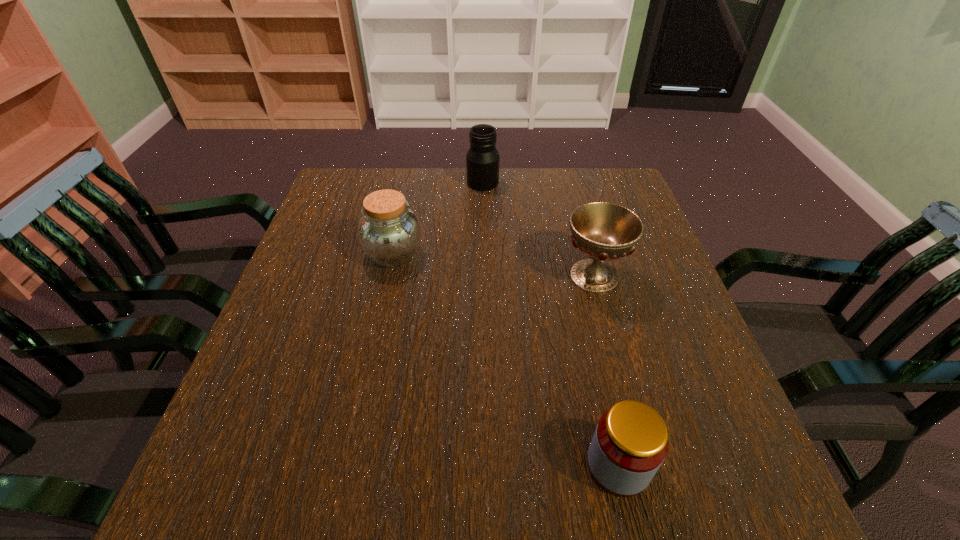
Where is `the farthest object`? Image resolution: width=960 pixels, height=540 pixels. the farthest object is located at coordinates (482, 159).

This screenshot has height=540, width=960. Find the location of `the second jar from right to left`. the second jar from right to left is located at coordinates [482, 159].

Where is `the leftmost jar`? This screenshot has height=540, width=960. the leftmost jar is located at coordinates (389, 232).

The image size is (960, 540). Find the location of `the second nearest jar`. the second nearest jar is located at coordinates (389, 232).

At what (x,y) coordinates should I click in order to perform the action: click on chalice. Please return your answer as a coordinate pair (x, y). Looking at the image, I should click on (603, 231).

Where is `the rightmost jar`? the rightmost jar is located at coordinates (630, 443).

Locate an element on the screen. the nearest jar is located at coordinates (630, 443).

Find the location of a particular element. This screenshot has height=540, width=960. free spot located 0.160m on the left of the second object from left to right is located at coordinates (414, 183).

Where is `free space located on the front of the leftmost object`? The width and height of the screenshot is (960, 540). free space located on the front of the leftmost object is located at coordinates (362, 403).

I want to click on free space located on the left of the chalice, so tap(447, 275).